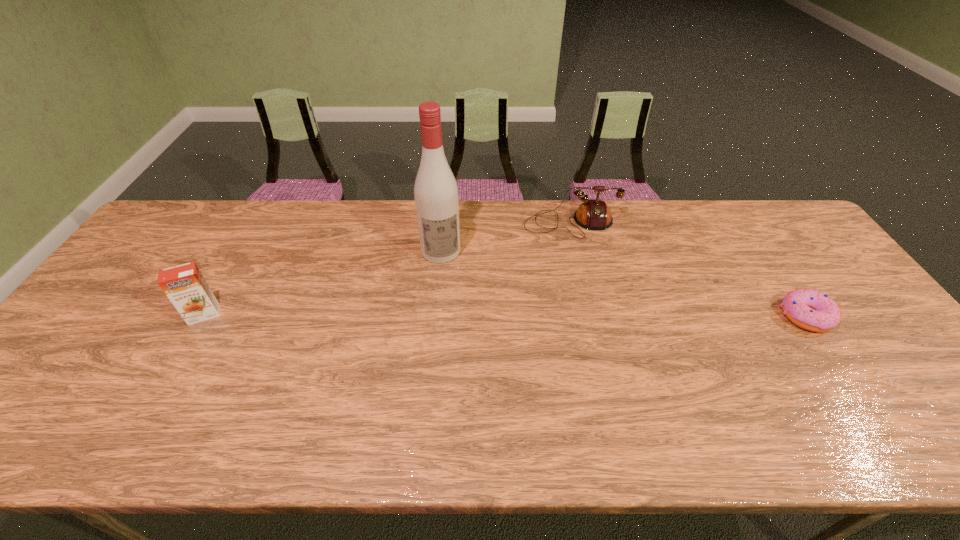
Locate an element on the screen. This screenshot has width=960, height=540. free spot on the desktop that is between the orange juice and the shortest object and is positioned on the label of the tallest object is located at coordinates (453, 315).

This screenshot has width=960, height=540. What are the coordinates of `vacant space on the desktop that is between the leftmost object and the rightmost object and is positioned on the rotary dial of the telephone` in the screenshot? It's located at (589, 315).